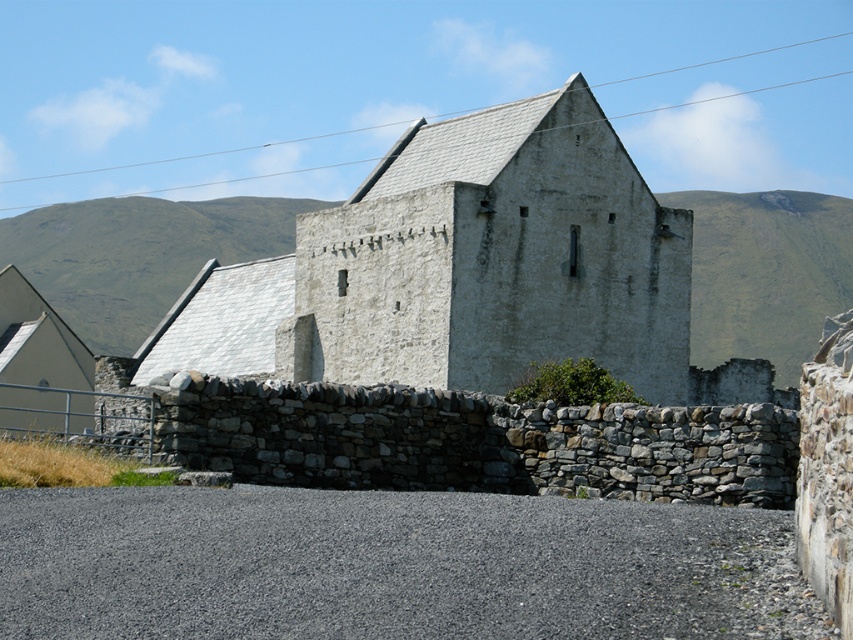
Between white stone chapel at center and green grassy hillside at upper left, which one appears on the right side from the viewer's perspective?

From the viewer's perspective, white stone chapel at center appears more on the right side.

Does point (744, 360) come in front of point (158, 296)?

Yes, point (744, 360) is closer to viewer.

Between point (515, 272) and point (157, 273), which one is positioned in front?

Point (515, 272) is more forward.

This screenshot has height=640, width=853. Find the location of `white stone chapel at center`. white stone chapel at center is located at coordinates (468, 269).